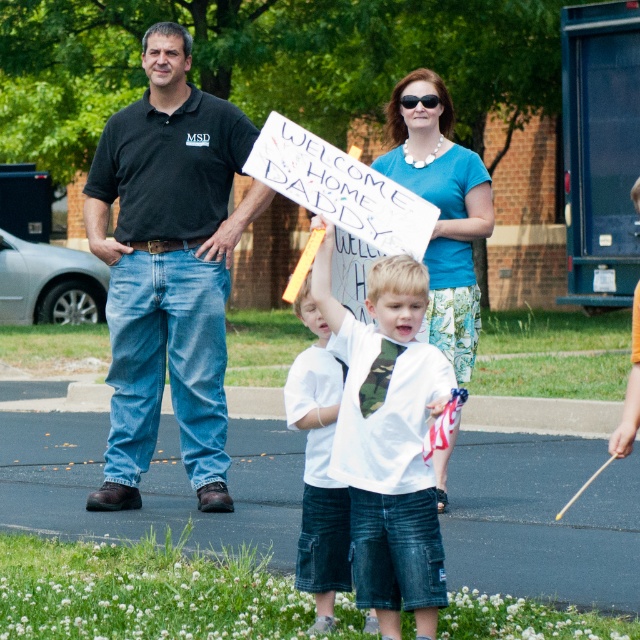
Question: Which object appears farthest from the camera in this image?

Choices:
 (A) blue fabric shirt at upper center
 (B) camouflage tie at center

Answer: (A)

Question: Which point is closer to the camera taking this photo?

Choices:
 (A) (97, 180)
 (B) (314, 484)

Answer: (B)

Question: Based on their relative distances, which object is nearer to the blue fabric shirt at upper center?

Choices:
 (A) black cotton polo shirt at center
 (B) white cotton shirt at center
 (C) camouflage tie at center

Answer: (A)

Question: Does blue fabric shirt at upper center lie behind white cotton shirt at center?

Choices:
 (A) yes
 (B) no

Answer: (A)

Question: Is black cotton polo shirt at center smaller than camouflage tie at center?

Choices:
 (A) no
 (B) yes

Answer: (A)

Question: Is camouflage tie at center wider than white cotton shirt at center?

Choices:
 (A) no
 (B) yes

Answer: (B)